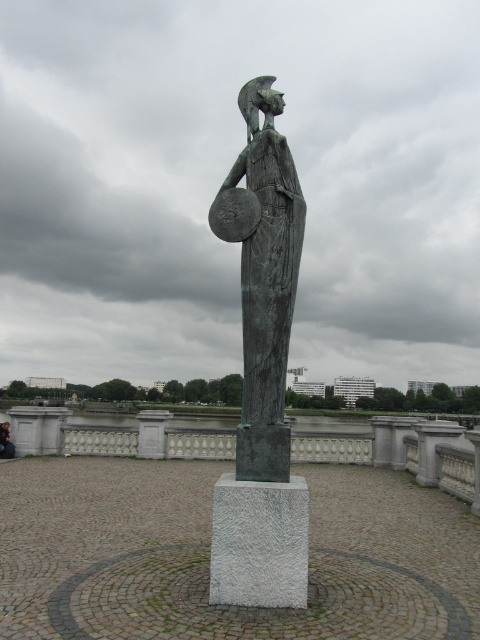
Is point (254, 248) less distant than point (12, 452)?

Yes, point (254, 248) is closer to viewer.

Does green patina statue at center appear on the left side of dark brown leather jacket at center?

In fact, green patina statue at center is to the right of dark brown leather jacket at center.

Between point (273, 241) and point (8, 444), which one is positioned behind?

Positioned behind is point (8, 444).

I want to click on green patina statue at center, so click(263, 276).